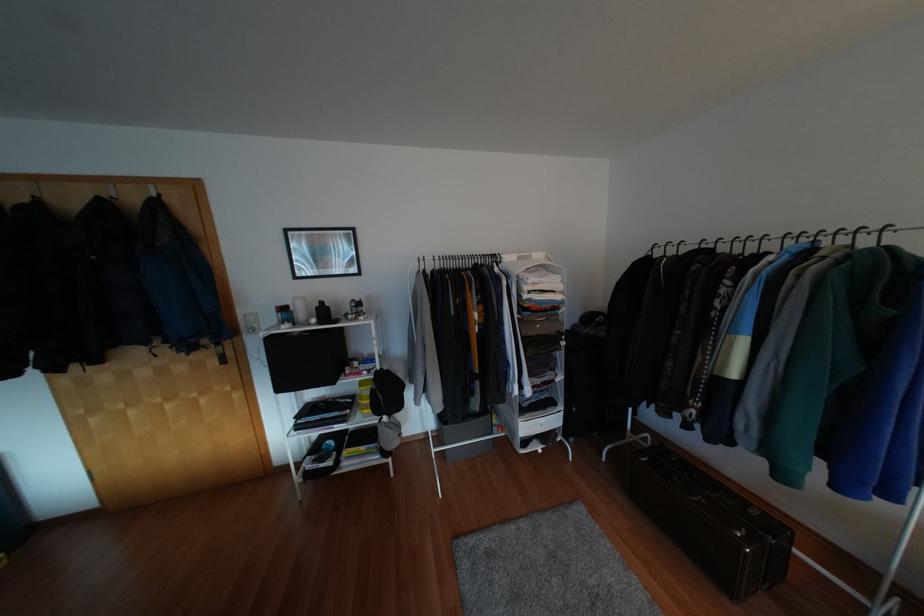
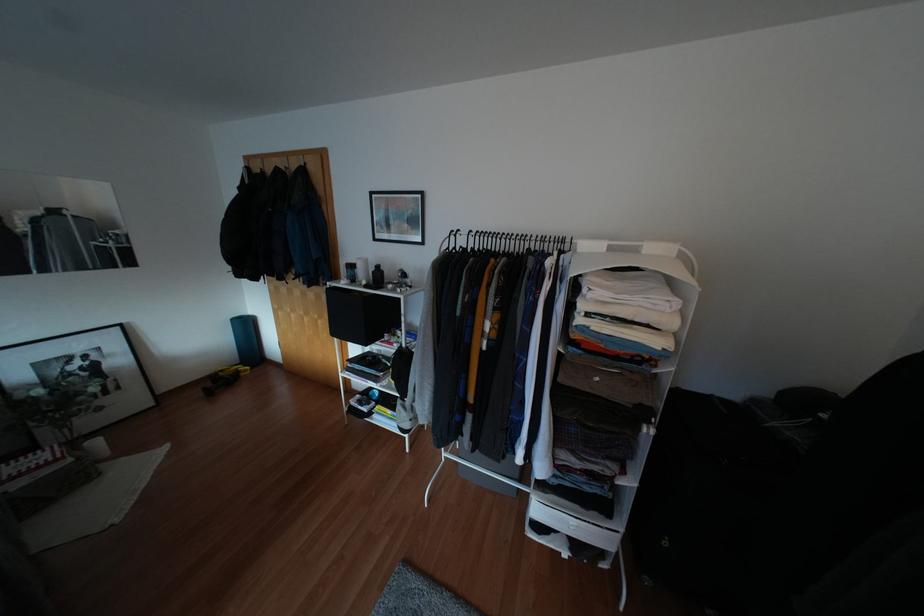
In the second image, find the point that corresponds to [321,302] in the first image.

(377, 265)